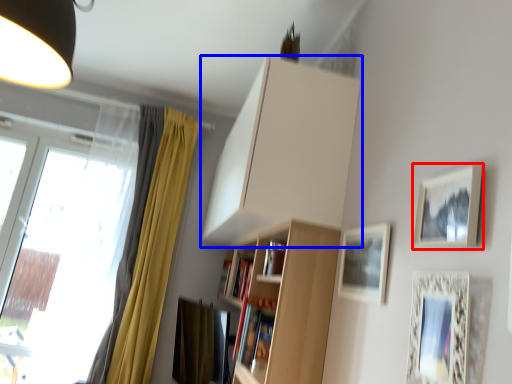
Question: Among these objects, which one is farthest to the camera, picture frame (highlighted by a red box) or cabinetry (highlighted by a blue box)?

Choices:
 (A) picture frame
 (B) cabinetry

Answer: (B)